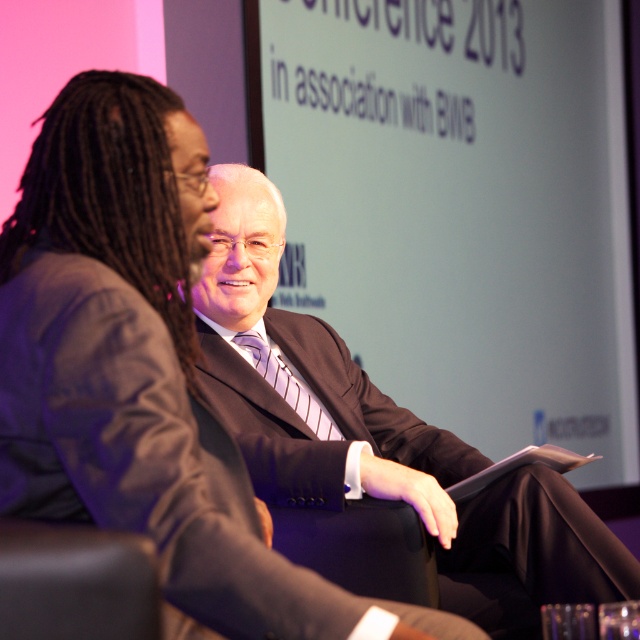
Question: Estimate the real-world distances between objects in this image. Which object is farther from the black leather chair at lower left?

Choices:
 (A) matte black suit at center
 (B) matte black suit at left

Answer: (A)

Question: Can you confirm if matte black suit at center is wider than black leather chair at lower left?

Choices:
 (A) yes
 (B) no

Answer: (A)

Question: Which object is closer to the camera taking this photo?

Choices:
 (A) matte black suit at center
 (B) matte black suit at left
 (C) black leather chair at lower left

Answer: (C)

Question: Does matte black suit at center have a larger size compared to black leather chair at lower left?

Choices:
 (A) yes
 (B) no

Answer: (A)

Question: Which object is closer to the camera taking this photo?

Choices:
 (A) matte black suit at center
 (B) matte black suit at left

Answer: (B)

Question: Can you confirm if matte black suit at left is bigger than matte black suit at center?

Choices:
 (A) no
 (B) yes

Answer: (A)